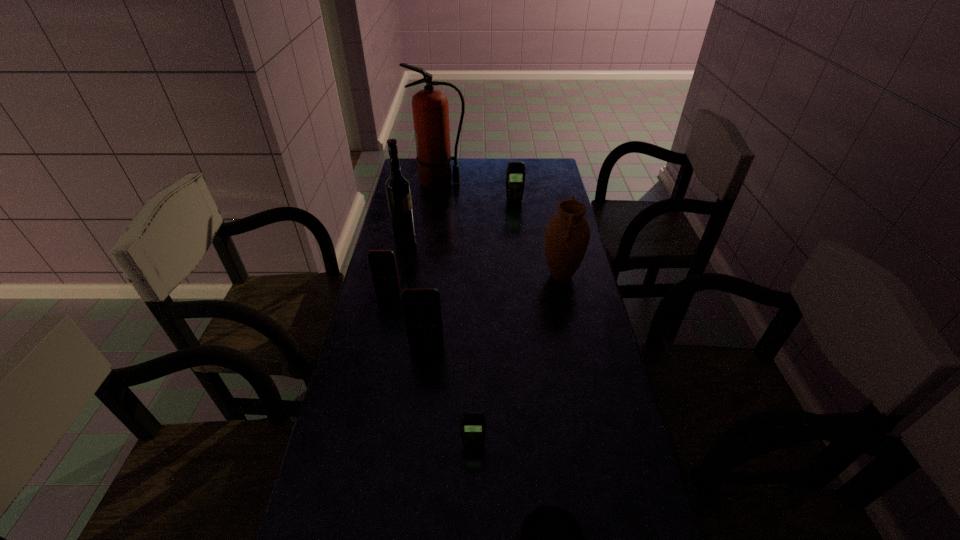
Locate an element on the screen. The width and height of the screenshot is (960, 540). fire extinguisher is located at coordinates (430, 108).

The height and width of the screenshot is (540, 960). What are the coordinates of `the tallest object` in the screenshot? It's located at (430, 108).

You are a GUI agent. You are given a task and a screenshot of the screen. Output one action in this format:
    pyautogui.click(x=<x>, y=<y>)
    Task: Click on the sixth nearest object
    The image size is (960, 540).
    Given the screenshot: What is the action you would take?
    pyautogui.click(x=398, y=190)

Identify the location of the second tallest object. The height and width of the screenshot is (540, 960). (398, 190).

Locate an element on the screen. the third tallest object is located at coordinates [567, 235].

What are the coordinates of `urn` in the screenshot? It's located at (567, 235).

Locate an element on the screen. the fourth tallest object is located at coordinates coord(421,306).

This screenshot has height=540, width=960. I want to click on the second nearest cellular telephone, so click(421, 306).

You are a GUI agent. You are given a task and a screenshot of the screen. Output one action in this format:
    pyautogui.click(x=<x>, y=<y>)
    Task: Click on the rightmost cellular telephone
    Image resolution: width=960 pixels, height=540 pixels.
    Given the screenshot: What is the action you would take?
    pyautogui.click(x=515, y=176)

Where is `the right gray cellular telephone`? The height and width of the screenshot is (540, 960). the right gray cellular telephone is located at coordinates (515, 176).